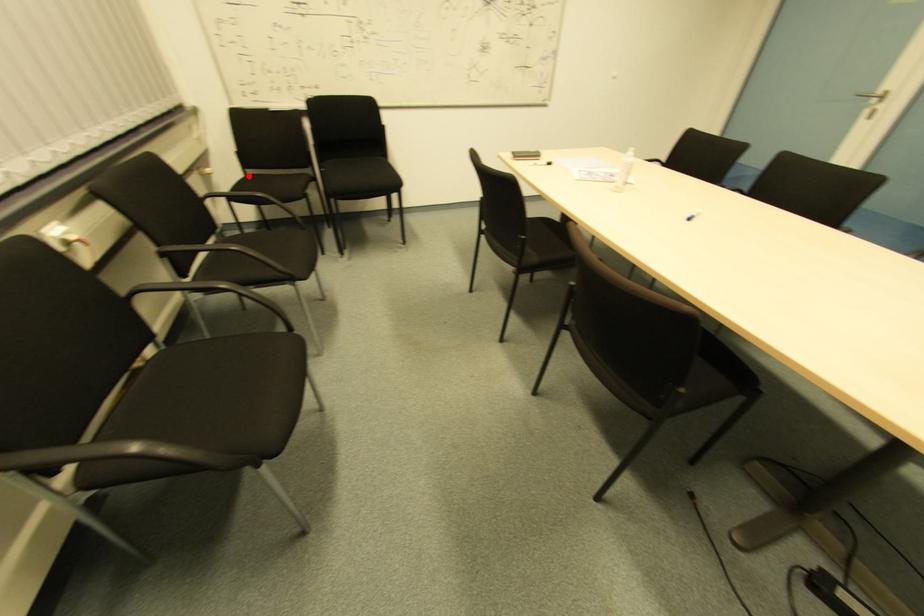
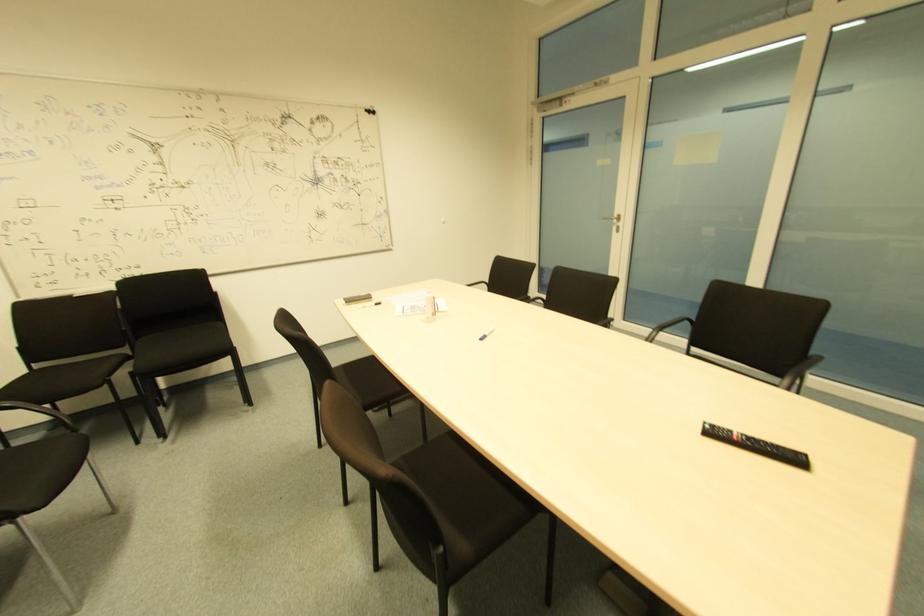
Question: I am providing you with two images of the same scene from different viewpoints. A red point is shown in image1. For the corresponding object point in image2, is it positioned nearer or farther from the camera?

Choices:
 (A) Nearer
 (B) Farther

Answer: (B)